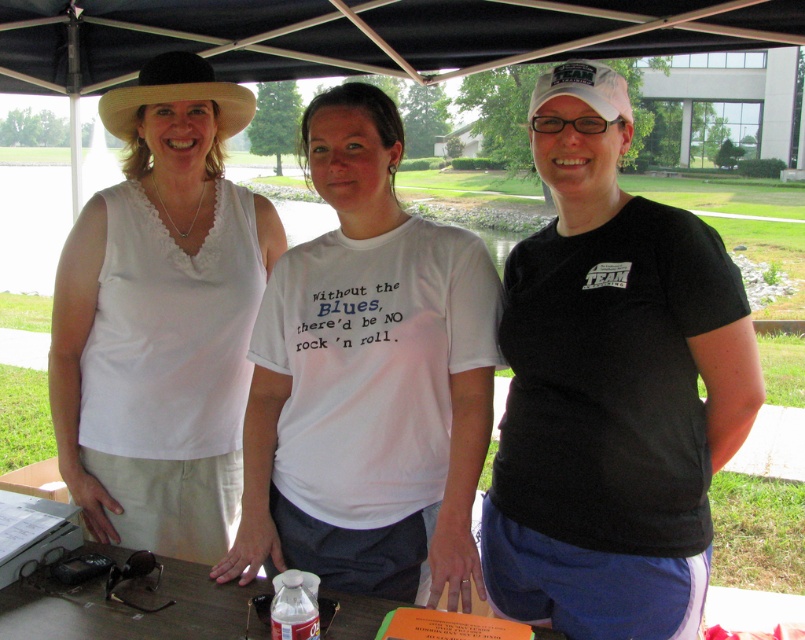
Is black matte t-shirt at center positioned behind white cotton t-shirt at center?

No, black matte t-shirt at center is in front of white cotton t-shirt at center.

Between point (620, 534) and point (261, 340), which one is positioned behind?

Point (261, 340)

You are a GUI agent. You are given a task and a screenshot of the screen. Output one action in this format:
    pyautogui.click(x=<x>, y=<y>)
    Task: Click on the black matte t-shirt at center
    
    Given the screenshot: What is the action you would take?
    pyautogui.click(x=611, y=387)

Between point (401, 314) and point (76, 476), which one is positioned in front?

Positioned in front is point (401, 314).

Does white cotton t-shirt at center have a greater width compared to white fabric tank top at left?

Indeed, white cotton t-shirt at center has a greater width compared to white fabric tank top at left.

Between point (308, 445) and point (217, 317), which one is positioned behind?

The point (217, 317) is more distant.

The height and width of the screenshot is (640, 805). I want to click on white cotton t-shirt at center, so click(366, 380).

What do you see at coordinates (611, 387) in the screenshot?
I see `black matte t-shirt at center` at bounding box center [611, 387].

Who is more distant from viewer, (x=671, y=628) or (x=168, y=84)?

Point (x=168, y=84)

Find the location of a particular element. The height and width of the screenshot is (640, 805). black matte t-shirt at center is located at coordinates (611, 387).